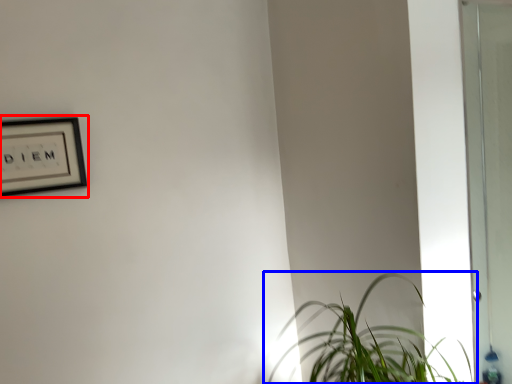
Question: Among these objects, which one is farthest to the camera, picture frame (highlighted by a red box) or houseplant (highlighted by a blue box)?

Choices:
 (A) picture frame
 (B) houseplant

Answer: (A)